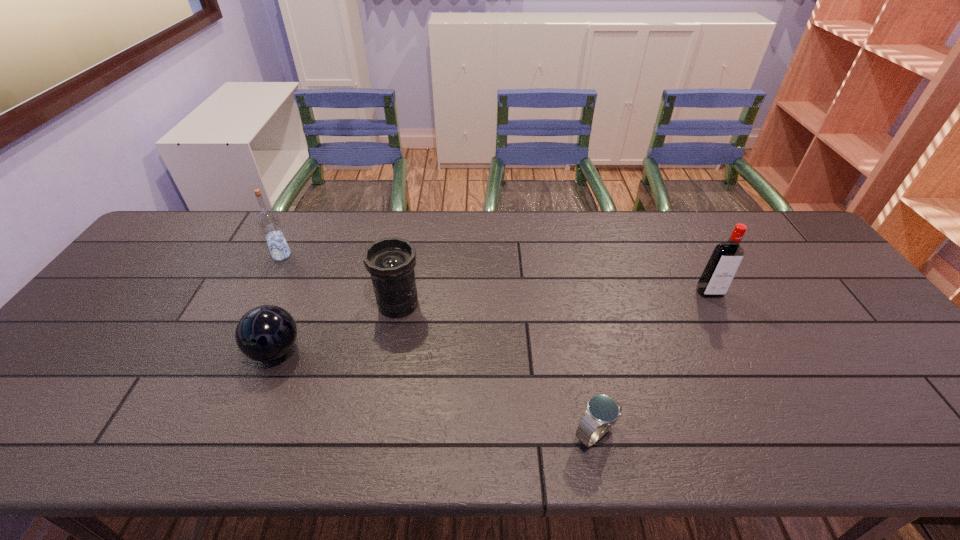
Locate an element on the screen. The height and width of the screenshot is (540, 960). blank space located on the front of the leftmost object is located at coordinates (258, 301).

At what (x,y) coordinates should I click in order to perform the action: click on blank space located on the front and back of the nearer vodka. Please return your answer as a coordinate pair (x, y). The image size is (960, 540). Looking at the image, I should click on (774, 413).

Locate an element on the screen. vacant area located on the front of the third shortest object is located at coordinates (391, 346).

Find the location of a particular element. This screenshot has width=960, height=540. vacant area situated on the side of the bowling ball with the finger holes is located at coordinates (249, 415).

Locate an element on the screen. vacant space situated on the left of the shortest object is located at coordinates (519, 434).

In order to click on object at the far edge in this screenshot , I will do `click(268, 220)`.

Locate an element on the screen. The image size is (960, 540). object that is at the near edge is located at coordinates (602, 411).

Image resolution: width=960 pixels, height=540 pixels. In the image, there is a desktop. Identify the location of vacant space at the far edge. (568, 253).

In the image, there is a desktop. Where is `vacant space at the near edge`? This screenshot has height=540, width=960. vacant space at the near edge is located at coordinates (305, 441).

At what (x,y) coordinates should I click in order to perform the action: click on free region at the left edge of the desktop. Please return your answer as a coordinate pair (x, y). Looking at the image, I should click on (156, 266).